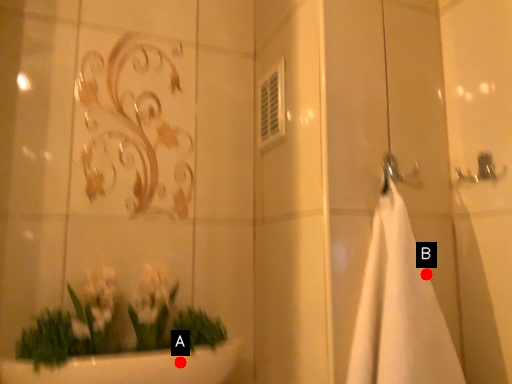
Question: Two points are circled on the image, labeled by A and B beside each circle. Which point appears closest to the camera in this image?

Choices:
 (A) A is closer
 (B) B is closer

Answer: (B)